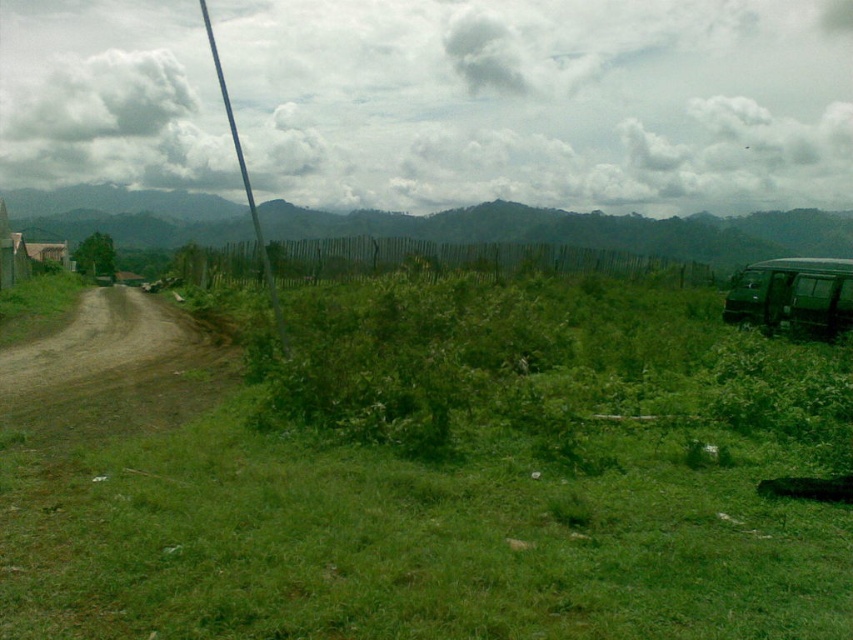
Who is positioned more to the left, green grass at center or green matte van at right?

green grass at center is more to the left.

Measure the distance between point (570, 364) and camera.

Point (570, 364) is 13.81 meters away from camera.

At what (x,y) coordinates should I click in order to perform the action: click on green grass at center. Please return your answer as a coordinate pair (x, y). Looking at the image, I should click on point(440,486).

Who is higher up, green grass at center or brown dirt track at left?

brown dirt track at left

Does green grass at center appear on the left side of brown dirt track at left?

In fact, green grass at center is to the right of brown dirt track at left.

Does point (424, 477) come behind point (119, 413)?

No, (424, 477) is in front of (119, 413).

The width and height of the screenshot is (853, 640). In order to click on green grass at center in this screenshot , I will do coord(440,486).

Who is more distant from viewer, (91,349) or (769,324)?

The point (769,324) is behind.

At what (x,y) coordinates should I click in order to perform the action: click on brown dirt track at left. Please return your answer as a coordinate pair (x, y). Image resolution: width=853 pixels, height=640 pixels. Looking at the image, I should click on (109, 369).

You are a GUI agent. You are given a task and a screenshot of the screen. Output one action in this format:
    pyautogui.click(x=<x>, y=<y>)
    Task: Click on the brown dirt track at left
    
    Given the screenshot: What is the action you would take?
    pyautogui.click(x=109, y=369)